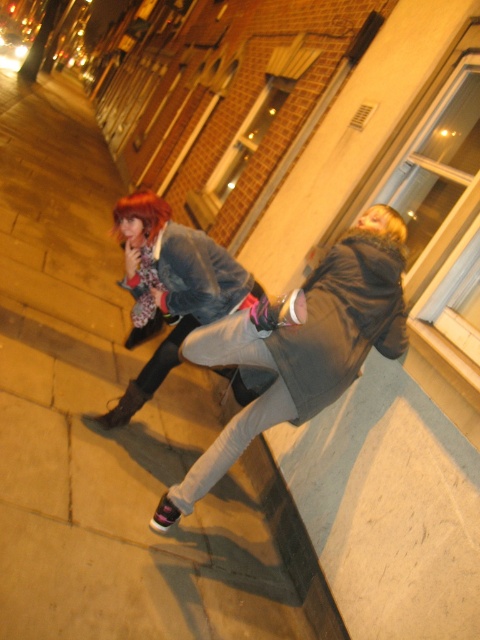
Question: Estimate the real-world distances between objects in this image. Which object is farther from the matte black jacket at upper left?

Choices:
 (A) concrete at lower left
 (B) blondehair at right
 (C) dark gray hoodie at center

Answer: (A)

Question: Which point is closer to the camera?

Choices:
 (A) (360, 244)
 (B) (60, 403)
 (C) (219, 298)
 (D) (131, 216)

Answer: (A)

Question: Is concrete at lower left positioned before dark gray hoodie at center?

Choices:
 (A) no
 (B) yes

Answer: (B)

Question: Is concrete at lower left behind blondehair at right?

Choices:
 (A) yes
 (B) no

Answer: (B)

Question: Can you confirm if dark gray hoodie at center is wider than shiny red hair at upper left?

Choices:
 (A) no
 (B) yes

Answer: (B)

Question: Which object appears farthest from the camera in this image?

Choices:
 (A) shiny red hair at upper left
 (B) matte black jacket at upper left

Answer: (A)